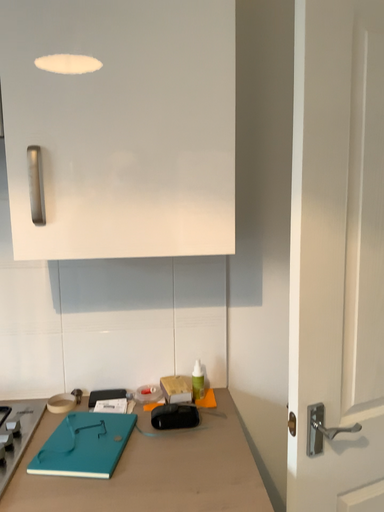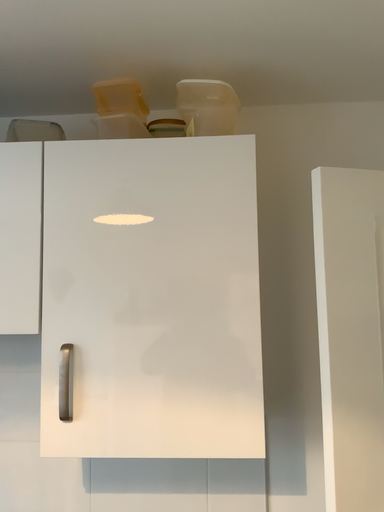
Question: Which way did the camera rotate in the video?

Choices:
 (A) rotated upward
 (B) rotated downward

Answer: (A)